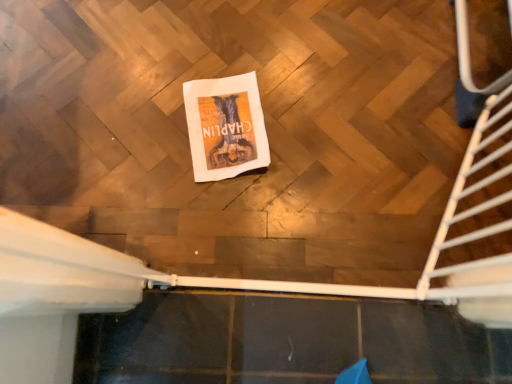
This screenshot has height=384, width=512. I want to click on vacant space situated on the left part of white metal stairs at right, so click(x=326, y=149).